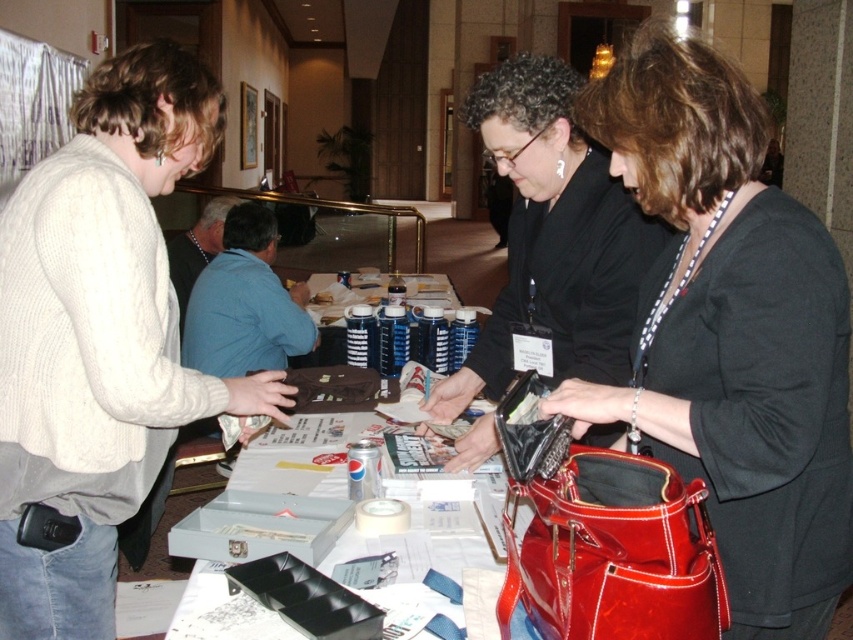
Question: Can you confirm if white knit sweater at left is positioned below glossy patent leather handbag at lower right?

Choices:
 (A) yes
 (B) no

Answer: (B)

Question: Which object is farther from the camera taking this photo?

Choices:
 (A) shiny patent leather handbag at center
 (B) black leather purse at center
 (C) glossy patent leather handbag at lower right
 (D) white paper at center

Answer: (B)

Question: Estimate the real-world distances between objects in this image. Which object is closer to the shiny patent leather handbag at center?

Choices:
 (A) white paper at center
 (B) black leather purse at center
 (C) white knit sweater at left

Answer: (B)

Question: Does black leather purse at center lie behind white paper at center?

Choices:
 (A) yes
 (B) no

Answer: (A)

Question: Which object is closer to the camera taking this photo?

Choices:
 (A) glossy patent leather handbag at lower right
 (B) white knit sweater at left
 (C) shiny patent leather handbag at center

Answer: (A)

Question: From the image, what is the correct spatial relationship of black leather purse at center in relation to glossy patent leather handbag at lower right?

Choices:
 (A) above
 (B) below

Answer: (A)